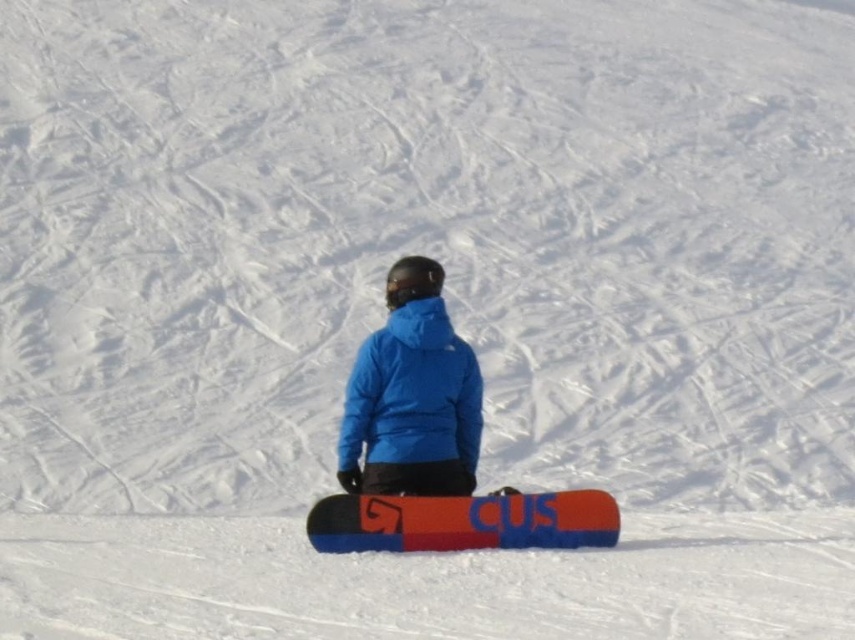
Is blue matte snowboarder at center above orange matte snowboard at center?

Yes, blue matte snowboarder at center is above orange matte snowboard at center.

Between point (435, 280) and point (382, 545), which one is positioned in front?

Point (382, 545)

You are a GUI agent. You are given a task and a screenshot of the screen. Output one action in this format:
    pyautogui.click(x=<x>, y=<y>)
    Task: Click on the blue matte snowboarder at center
    This screenshot has width=855, height=640.
    Given the screenshot: What is the action you would take?
    pyautogui.click(x=432, y=445)

Can you confirm if blue matte snowboarder at center is shorter than blue synthetic jacket at center?

Incorrect, blue matte snowboarder at center's height does not fall short of blue synthetic jacket at center's.

Can you confirm if blue matte snowboarder at center is thinner than blue synthetic jacket at center?

Incorrect, blue matte snowboarder at center's width is not less than blue synthetic jacket at center's.

You are a GUI agent. You are given a task and a screenshot of the screen. Output one action in this format:
    pyautogui.click(x=<x>, y=<y>)
    Task: Click on the blue matte snowboarder at center
    The height and width of the screenshot is (640, 855).
    Given the screenshot: What is the action you would take?
    pyautogui.click(x=432, y=445)

This screenshot has height=640, width=855. What are the coordinates of `blue matte snowboarder at center` in the screenshot? It's located at (432, 445).

Is point (372, 390) positioned behind point (510, 544)?

Yes, point (372, 390) is behind point (510, 544).

This screenshot has width=855, height=640. I want to click on blue synthetic jacket at center, so [x=411, y=394].

Where is `blue synthetic jacket at center`? This screenshot has height=640, width=855. blue synthetic jacket at center is located at coordinates (411, 394).